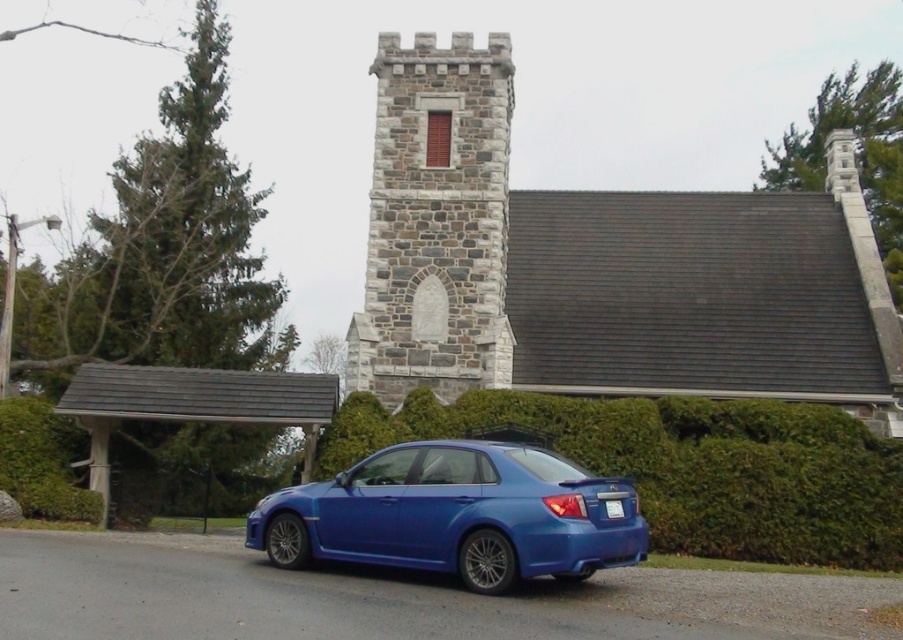
Where is `green leafy hedge at center`? This screenshot has height=640, width=903. green leafy hedge at center is located at coordinates (687, 467).

Can you confirm if green leafy hedge at center is bigger than glossy blue sedan at center?

Indeed, green leafy hedge at center has a larger size compared to glossy blue sedan at center.

Which is in front, point (386, 428) or point (604, 538)?

Point (604, 538) is in front.

Locate an element on the screen. This screenshot has height=640, width=903. green leafy hedge at center is located at coordinates (687, 467).

Who is taller, stone church at center or stone brick tower at center?

With more height is stone church at center.

Is point (441, 189) farther from camera compared to point (408, 336)?

Yes.

Where is `stone church at center`? This screenshot has height=640, width=903. stone church at center is located at coordinates (601, 266).

Does green leafy hedge at center have a larger size compared to stone brick tower at center?

No, green leafy hedge at center is not bigger than stone brick tower at center.

What do you see at coordinates (687, 467) in the screenshot? This screenshot has height=640, width=903. I see `green leafy hedge at center` at bounding box center [687, 467].

Find the location of a particular element. green leafy hedge at center is located at coordinates (687, 467).